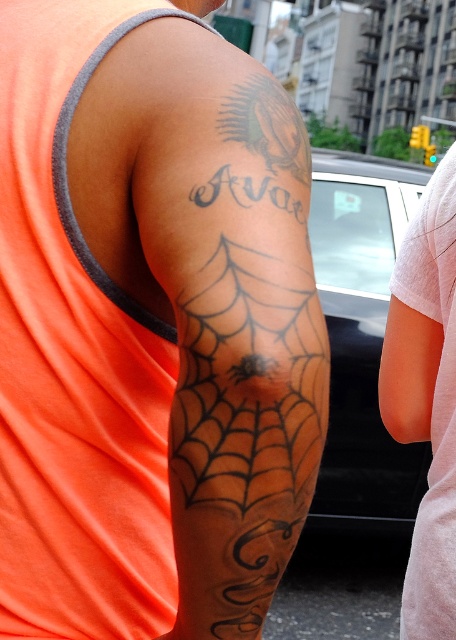
You are a tattoo artist assessing a client who wants to add a new tattoo to their sleeveless orange shirt. The client shows you the black ink spiderweb tattoo at upper right and the white cotton shirt at right. Which object takes up more space in the image?

The white cotton shirt at right takes up more space in the image than the black ink spiderweb tattoo at upper right because the tattoo is smaller than the shirt.

You are a fashion designer observing the image. You need to decide if the black ink spiderweb tattoo at upper right can be fully covered by the white cotton shirt at right when the person wears it. Based on the size comparison between them, what is your conclusion?

The black ink spiderweb tattoo at upper right is not as tall as the white cotton shirt at right, so the white cotton shirt at right can fully cover the black ink spiderweb tattoo at upper right when worn.

You are a photographer adjusting your camera to focus on two points on the tattoo. The first point is at coordinates point (182, 113) and the second point is at point (412, 337). Which point should you focus on first to ensure the closest part of the tattoo is sharp?

Point (182, 113) is closer to the camera than point (412, 337), so you should focus on point (182, 113) first to capture the closest part of the tattoo sharply.